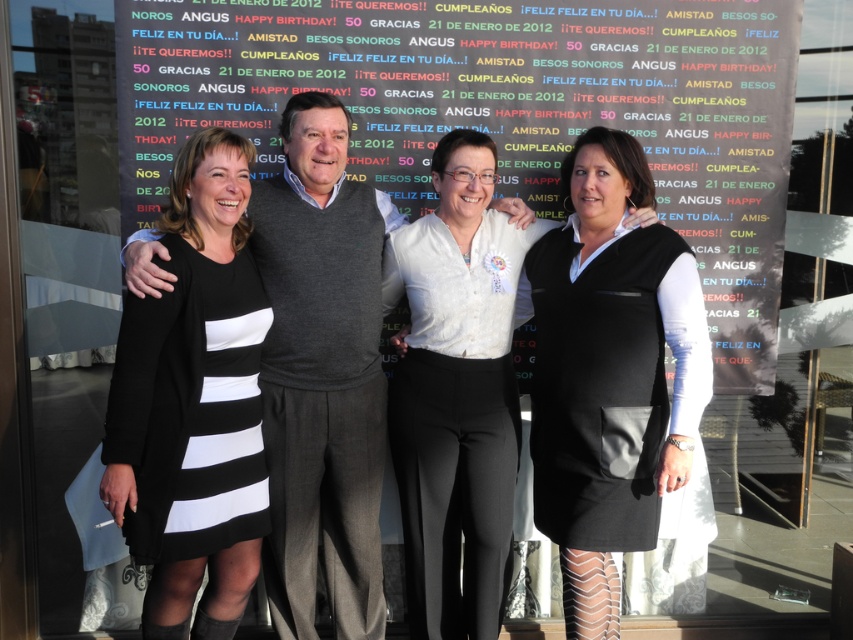
Question: Which of these objects is positioned farthest from the dark gray sweater at center?

Choices:
 (A) white textured blouse at center
 (B) black matte dress at left
 (C) multicolored fabric banner at center
 (D) matte black dress at center

Answer: (C)

Question: Can you confirm if black matte dress at left is bigger than matte black dress at center?

Choices:
 (A) yes
 (B) no

Answer: (B)

Question: Does multicolored fabric banner at center have a larger size compared to white textured blouse at center?

Choices:
 (A) yes
 (B) no

Answer: (A)

Question: Which point is farther to the camera?

Choices:
 (A) [x=241, y=570]
 (B) [x=576, y=477]

Answer: (B)

Question: Which point is farther from the camera taking this photo?

Choices:
 (A) (270, 512)
 (B) (241, 20)

Answer: (B)

Question: Can you confirm if dark gray sweater at center is thinner than white textured blouse at center?

Choices:
 (A) yes
 (B) no

Answer: (A)